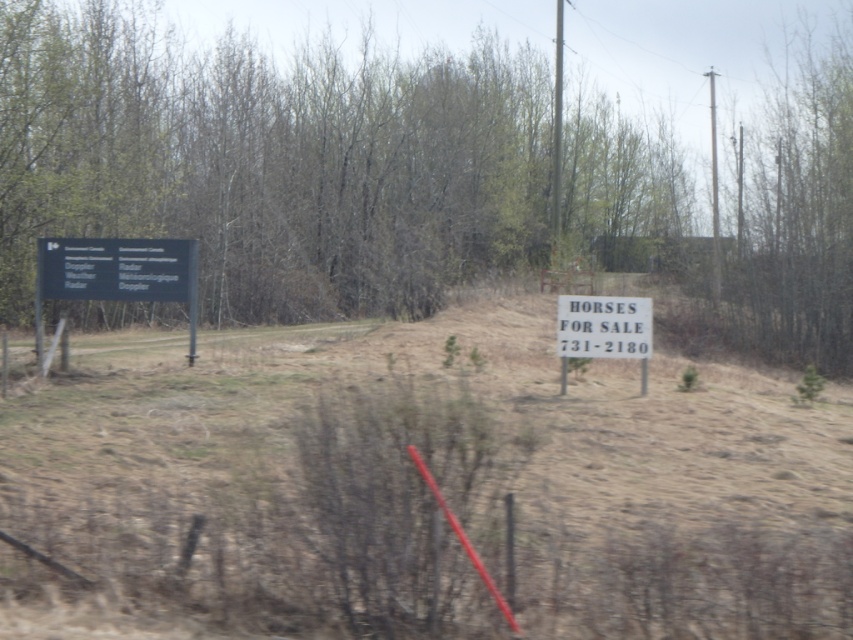
You are a hiker who wants to take a photo of both the green leafy tree at upper center and the black plastic sign at left in the same frame. Given that your camera can capture a maximum distance of 30 meters between objects, will you be able to include both in one photo?

The green leafy tree at upper center and the black plastic sign at left are 29.58 meters apart, which is within the camera maximum distance of 30 meters, so yes, you can include both in one photo.

You are a hiker trying to locate the HORSES FOR SALE sign. From your current position, you see the green leafy tree at upper center and the black plastic sign at left. Which direction should you move to find the sign?

The black plastic sign at left is to the left of the green leafy tree at upper center, so you should move towards the left direction to find the sign.

You are a hiker who has come across a rural area with a dirt path. You notice two signs along the path. The first is a white paper sign at center, and the second is a black plastic sign at left. Which sign is shorter?

The white paper sign at center has a lesser height compared to the black plastic sign at left, so the white paper sign at center is shorter.